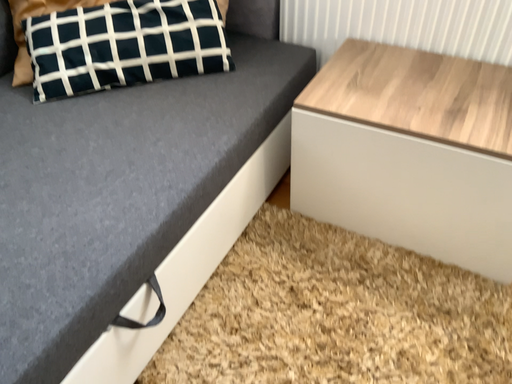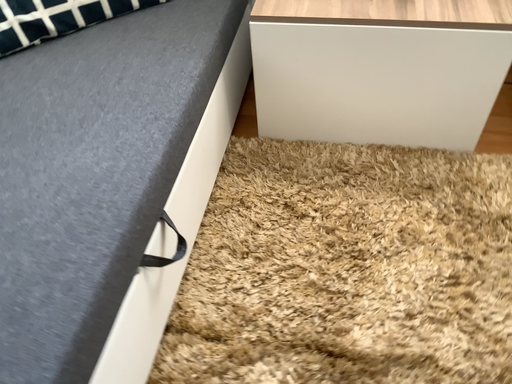
Question: How did the camera likely rotate when shooting the video?

Choices:
 (A) rotated left
 (B) rotated right

Answer: (B)